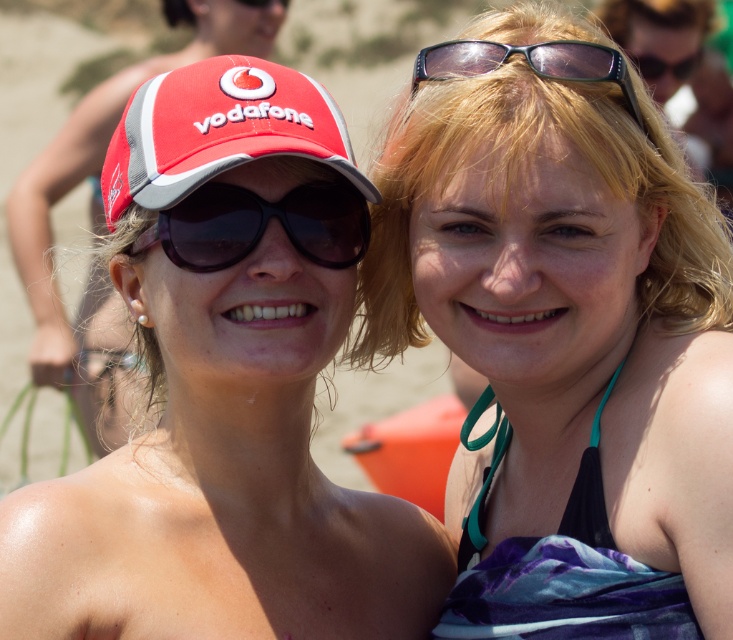
Question: Estimate the real-world distances between objects in this image. Which object is closer to the matte red cap at left?

Choices:
 (A) matte red cap at center
 (B) black plastic goggles at center

Answer: (A)

Question: Which object appears farthest from the camera in this image?

Choices:
 (A) matte black bikini top at center
 (B) matte red cap at center
 (C) matte red cap at left

Answer: (C)

Question: From the image, what is the correct spatial relationship of matte black bikini top at center in relation to transparent plastic goggles at upper center?

Choices:
 (A) left
 (B) right

Answer: (B)

Question: Can you confirm if matte black bikini top at center is positioned below red mesh cap at left?

Choices:
 (A) yes
 (B) no

Answer: (A)

Question: Does matte red cap at left have a smaller size compared to red mesh cap at left?

Choices:
 (A) no
 (B) yes

Answer: (A)

Question: Which point appears farthest from the camera in this image?

Choices:
 (A) (380, 582)
 (B) (165, 227)
 (C) (410, 182)

Answer: (A)